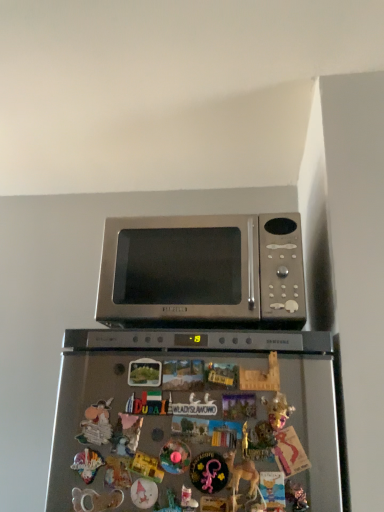
The height and width of the screenshot is (512, 384). In order to click on satin silver microwave at upper center in this screenshot , I will do `click(202, 271)`.

Describe the element at coordinates (202, 271) in the screenshot. I see `satin silver microwave at upper center` at that location.

Describe the element at coordinates (277, 410) in the screenshot. I see `gold metallic mask at upper center` at that location.

Find the location of a particular element. The image size is (384, 512). gold metallic mask at upper center is located at coordinates (277, 410).

You are a GUI agent. You are given a task and a screenshot of the screen. Output one action in this format:
    pyautogui.click(x=<x>, y=<y>)
    Task: Click on the satin silver microwave at upper center
    The height and width of the screenshot is (512, 384).
    Given the screenshot: What is the action you would take?
    pyautogui.click(x=202, y=271)

Considering the relative positions of satin silver microwave at upper center and gold metallic mask at upper center in the image provided, is satin silver microwave at upper center to the left of gold metallic mask at upper center from the viewer's perspective?

Yes, satin silver microwave at upper center is to the left of gold metallic mask at upper center.

Which is in front, satin silver microwave at upper center or gold metallic mask at upper center?

gold metallic mask at upper center.

Is point (268, 293) closer to viewer compared to point (283, 400)?

No.

Looking at this image, from the image's perspective, is satin silver microwave at upper center located above or below gold metallic mask at upper center?

satin silver microwave at upper center is above gold metallic mask at upper center.

From a real-world perspective, is satin silver microwave at upper center on top of gold metallic mask at upper center?

Yes, from a real-world perspective, satin silver microwave at upper center is over gold metallic mask at upper center

Is satin silver microwave at upper center wider or thinner than gold metallic mask at upper center?

Clearly, satin silver microwave at upper center has more width compared to gold metallic mask at upper center.

Can you confirm if satin silver microwave at upper center is taller than gold metallic mask at upper center?

Yes, satin silver microwave at upper center is taller than gold metallic mask at upper center.

Does satin silver microwave at upper center have a smaller size compared to gold metallic mask at upper center?

No.

Which is correct: satin silver microwave at upper center is inside gold metallic mask at upper center, or outside of it?

The correct answer is: outside.

Is satin silver microwave at upper center far away from gold metallic mask at upper center?

That's right, there is a large distance between satin silver microwave at upper center and gold metallic mask at upper center.

Is satin silver microwave at upper center facing away from gold metallic mask at upper center?

satin silver microwave at upper center does not have its back to gold metallic mask at upper center.

Can you tell me how much satin silver microwave at upper center and gold metallic mask at upper center differ in facing direction?

There is a 1.61-degree angle between the facing directions of satin silver microwave at upper center and gold metallic mask at upper center.

Find the location of a particular element. microwave oven behind the gold metallic mask at upper center is located at coordinates (202, 271).

Is gold metallic mask at upper center to the right of satin silver microwave at upper center from the viewer's perspective?

Yes, gold metallic mask at upper center is to the right of satin silver microwave at upper center.

Consider the image. Is gold metallic mask at upper center closer to camera compared to satin silver microwave at upper center?

Yes, gold metallic mask at upper center is in front of satin silver microwave at upper center.

Considering the positions of point (272, 415) and point (242, 229), is point (272, 415) closer or farther from the camera than point (242, 229)?

Point (272, 415).

From the image's perspective, does gold metallic mask at upper center appear lower than satin silver microwave at upper center?

Yes, from the image's perspective, gold metallic mask at upper center is beneath satin silver microwave at upper center.

From a real-world perspective, is gold metallic mask at upper center beneath satin silver microwave at upper center?

Yes, from a real-world perspective, gold metallic mask at upper center is under satin silver microwave at upper center.

Is gold metallic mask at upper center thinner than satin silver microwave at upper center?

Indeed, gold metallic mask at upper center has a lesser width compared to satin silver microwave at upper center.

Considering the sizes of objects gold metallic mask at upper center and satin silver microwave at upper center in the image provided, who is taller, gold metallic mask at upper center or satin silver microwave at upper center?

satin silver microwave at upper center is taller.

Who is bigger, gold metallic mask at upper center or satin silver microwave at upper center?

satin silver microwave at upper center is bigger.

Is gold metallic mask at upper center not inside satin silver microwave at upper center?

Absolutely, gold metallic mask at upper center is external to satin silver microwave at upper center.

Is gold metallic mask at upper center with satin silver microwave at upper center?

gold metallic mask at upper center and satin silver microwave at upper center are clearly separated.

Is gold metallic mask at upper center positioned with its back to satin silver microwave at upper center?

No, satin silver microwave at upper center is not at the back of gold metallic mask at upper center.

Can you tell me how much gold metallic mask at upper center and satin silver microwave at upper center differ in facing direction?

1.61 degrees separate the facing orientations of gold metallic mask at upper center and satin silver microwave at upper center.

Locate an element on the screen. This screenshot has height=512, width=384. toy in front of the satin silver microwave at upper center is located at coordinates (277, 410).

Image resolution: width=384 pixels, height=512 pixels. In order to click on microwave oven lying behind the gold metallic mask at upper center in this screenshot , I will do point(202,271).

At what (x,y) coordinates should I click in order to perform the action: click on toy below the satin silver microwave at upper center (from a real-world perspective). Please return your answer as a coordinate pair (x, y). Looking at the image, I should click on (277, 410).